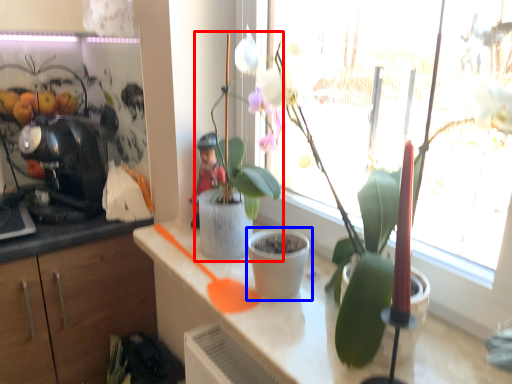
Question: Which object appears closest to the camera in this image, houseplant (highlighted by a red box) or flowerpot (highlighted by a blue box)?

Choices:
 (A) houseplant
 (B) flowerpot

Answer: (A)